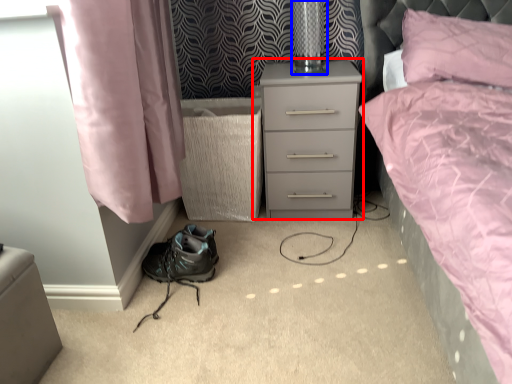
Question: Which object appears closest to the camera in this image, nightstand (highlighted by a red box) or table lamp (highlighted by a blue box)?

Choices:
 (A) nightstand
 (B) table lamp

Answer: (A)